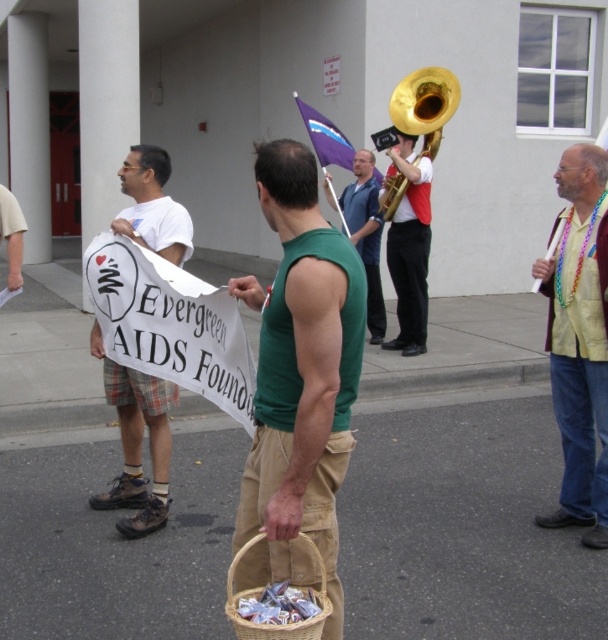
You are a photographer trying to capture the entire scene of the community event. You notice two specific points in the image at coordinates point (381, 212) and point (15, 227). Based on their positions, which point is closer to the camera?

Point (15, 227) is closer to the camera because it is positioned in front of point (381, 212).